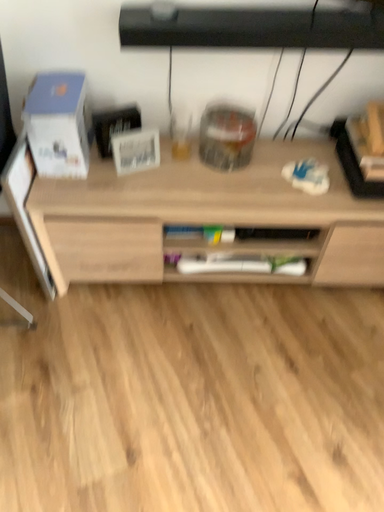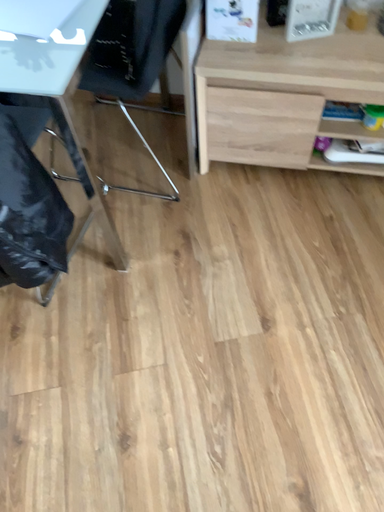
Question: Which way did the camera rotate in the video?

Choices:
 (A) rotated downward
 (B) rotated upward

Answer: (A)